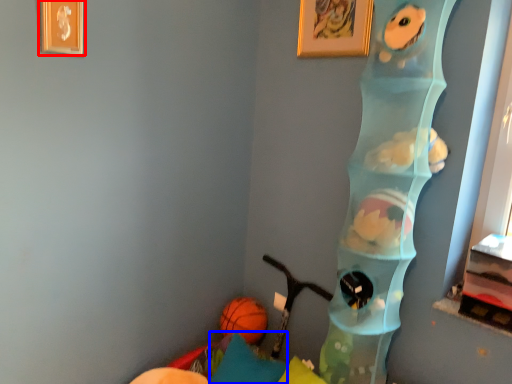
Question: Which object appears farthest to the camera in this image, picture frame (highlighted by a red box) or pillow (highlighted by a blue box)?

Choices:
 (A) picture frame
 (B) pillow

Answer: (B)